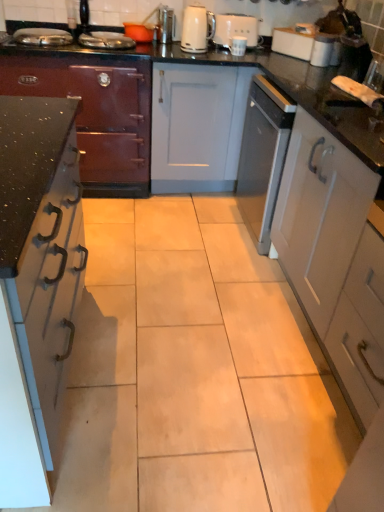
The image size is (384, 512). What are the coordinates of `vacant area in front of satin nickel toaster at upper center, the second appliance viewed from the left` in the screenshot? It's located at (174, 42).